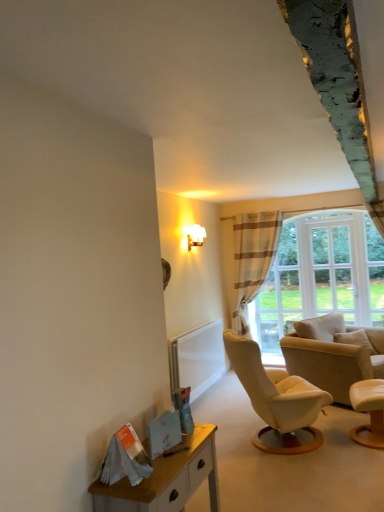
The width and height of the screenshot is (384, 512). In order to click on vacant area on the back side of smooth beige armchair at lower right, placed as the 2th chair when sorted from back to front in this screenshot , I will do `click(343, 420)`.